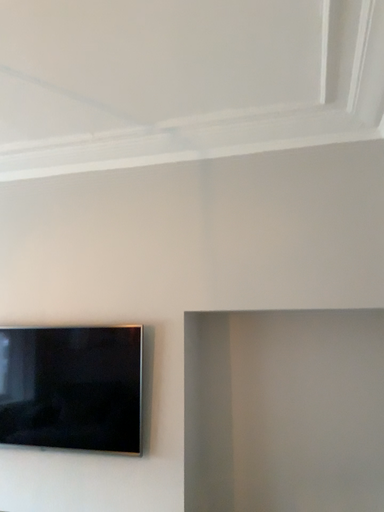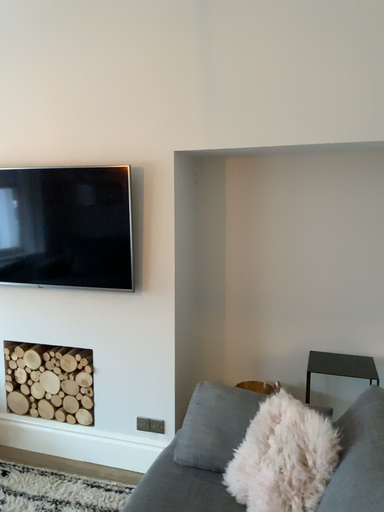
Question: Which way did the camera rotate in the video?

Choices:
 (A) rotated upward
 (B) rotated downward

Answer: (B)